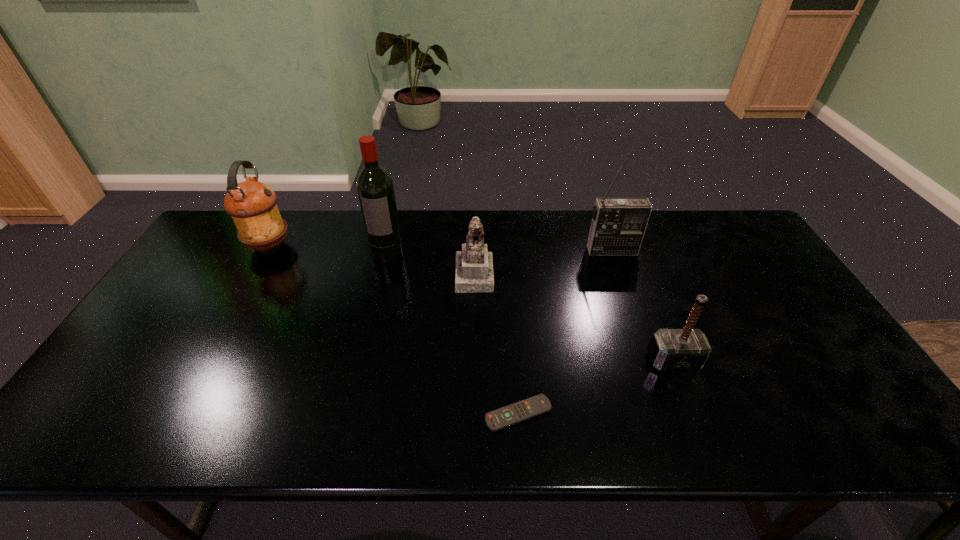
You are a GUI agent. You are given a task and a screenshot of the screen. Output one action in this format:
    pyautogui.click(x=<x>, y=<y>)
    Task: Click on the vacant space at the far edge of the desktop
    This screenshot has width=960, height=540.
    Given the screenshot: What is the action you would take?
    pyautogui.click(x=665, y=229)

Find the location of `free space at the near edge`. free space at the near edge is located at coordinates (583, 438).

Locate an element on the screen. The image size is (960, 540). vacant region at the left edge of the desktop is located at coordinates (201, 304).

The width and height of the screenshot is (960, 540). What are the coordinates of `vacant space at the right edge` in the screenshot? It's located at (735, 256).

Identify the location of free space at the far left corner of the desktop. (223, 240).

Locate an element on the screen. The image size is (960, 540). vacant space at the far right corner of the desktop is located at coordinates (736, 219).

What are the coordinates of `vacant region at the near right corner of the desktop` in the screenshot? It's located at (878, 410).

Where is `vacant area between the oil lamp and the wine bottle`? vacant area between the oil lamp and the wine bottle is located at coordinates (328, 249).

I want to click on vacant region between the leftmost object and the remote control, so click(394, 330).

I want to click on free spot between the hammer and the radio receiver, so click(x=643, y=305).